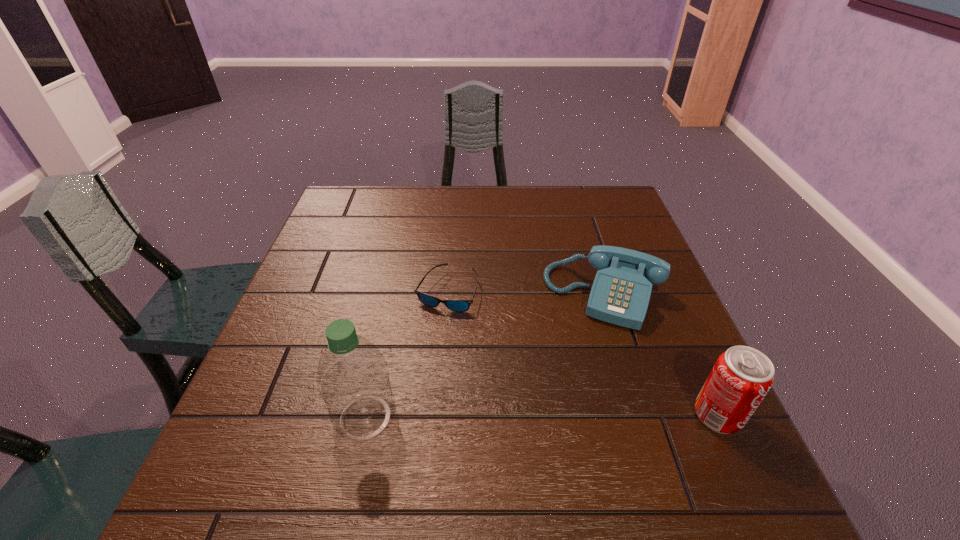
Identify the location of free spot located 0.330m at the front of the second object from left to right showing the lenses. (514, 435).

Locate an element on the screen. The image size is (960, 540). vacant area located on the dial of the second shortest object is located at coordinates (570, 387).

Find the location of a particular element. vacant space situated 0.200m on the dial of the second shortest object is located at coordinates (566, 399).

Find the location of a particular element. free space located 0.240m on the dial of the second shortest object is located at coordinates (562, 416).

Where is `water bottle located in the near edge section of the desktop`? Image resolution: width=960 pixels, height=540 pixels. water bottle located in the near edge section of the desktop is located at coordinates (353, 380).

Locate an element on the screen. The width and height of the screenshot is (960, 540). soda can that is at the near edge is located at coordinates (742, 376).

Where is `soda can that is at the right edge`? This screenshot has height=540, width=960. soda can that is at the right edge is located at coordinates (742, 376).

Locate an element on the screen. telephone at the right edge is located at coordinates (620, 294).

Where is `object that is at the near right corner`? This screenshot has width=960, height=540. object that is at the near right corner is located at coordinates 742,376.

Where is `vacant space at the far edge of the desktop`? This screenshot has height=540, width=960. vacant space at the far edge of the desktop is located at coordinates pyautogui.click(x=539, y=204).